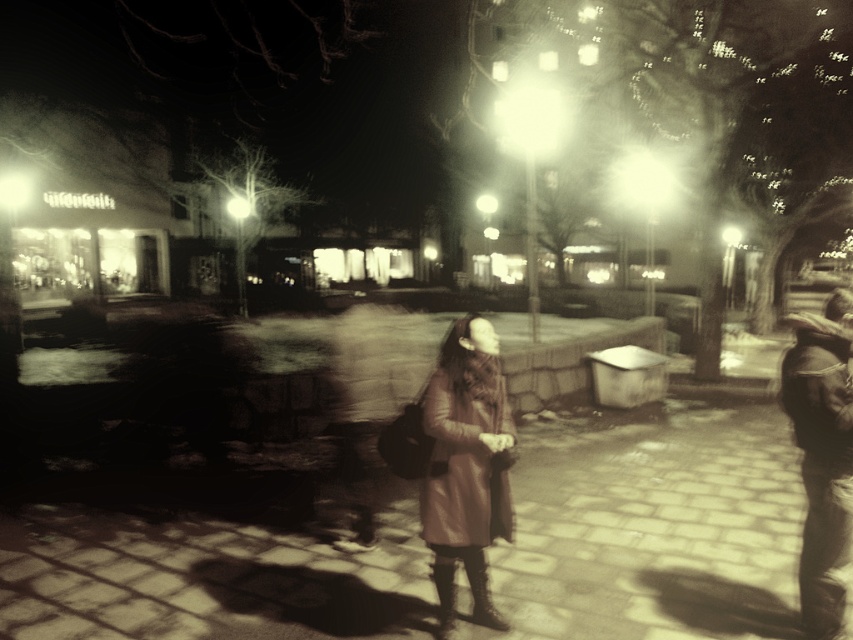
Who is taller, matte brown coat at center or leather jacket at right?

Standing taller between the two is leather jacket at right.

Is matte brown coat at center taller than leather jacket at right?

No, matte brown coat at center is not taller than leather jacket at right.

Based on the photo, who is more forward, (512, 442) or (848, 529)?

Point (848, 529)

Locate an element on the screen. Image resolution: width=853 pixels, height=640 pixels. matte brown coat at center is located at coordinates (466, 465).

Is leather coat at center to the right of leather jacket at right from the viewer's perspective?

Incorrect, leather coat at center is not on the right side of leather jacket at right.

Is leather coat at center smaller than leather jacket at right?

Indeed, leather coat at center has a smaller size compared to leather jacket at right.

Is point (767, 566) behind point (798, 419)?

Yes, it is behind point (798, 419).

In order to click on leather coat at center in this screenshot , I will do `click(648, 528)`.

Between smooth stone pavement at center and leather jacket at right, which one appears on the right side from the viewer's perspective?

From the viewer's perspective, leather jacket at right appears more on the right side.

The height and width of the screenshot is (640, 853). What are the coordinates of `smooth stone pavement at center` in the screenshot? It's located at (651, 529).

Where is `smooth stone pavement at center`? smooth stone pavement at center is located at coordinates (651, 529).